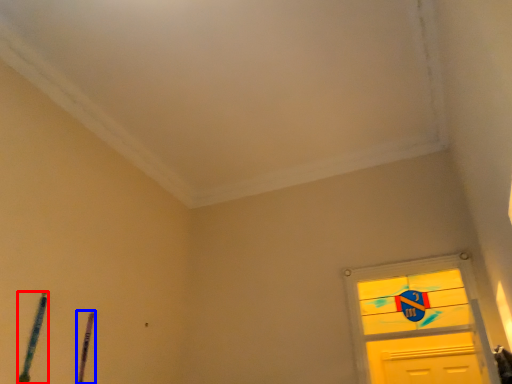
Question: Which object is closer to the camera taking this photo, twin (highlighted by a red box) or twin (highlighted by a blue box)?

Choices:
 (A) twin
 (B) twin

Answer: (A)